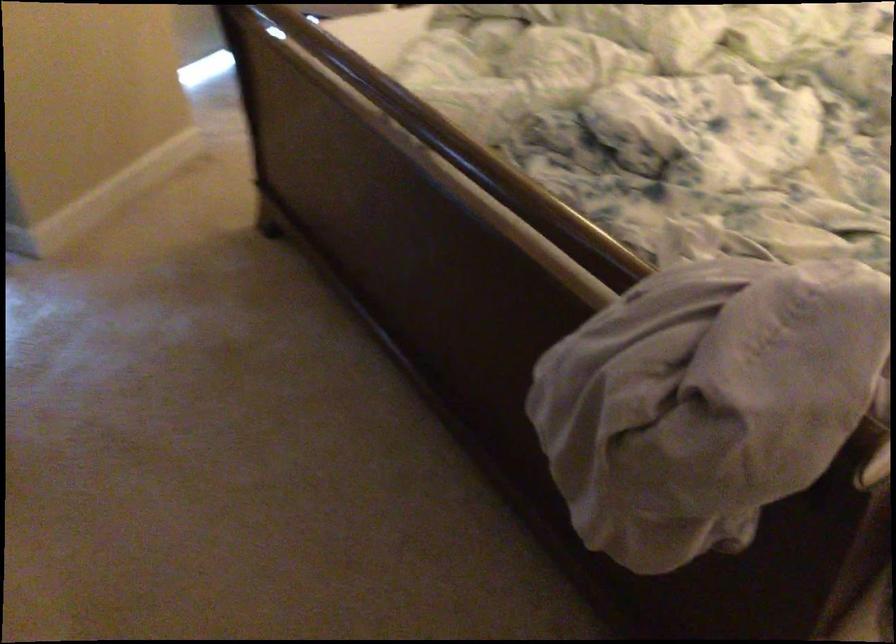
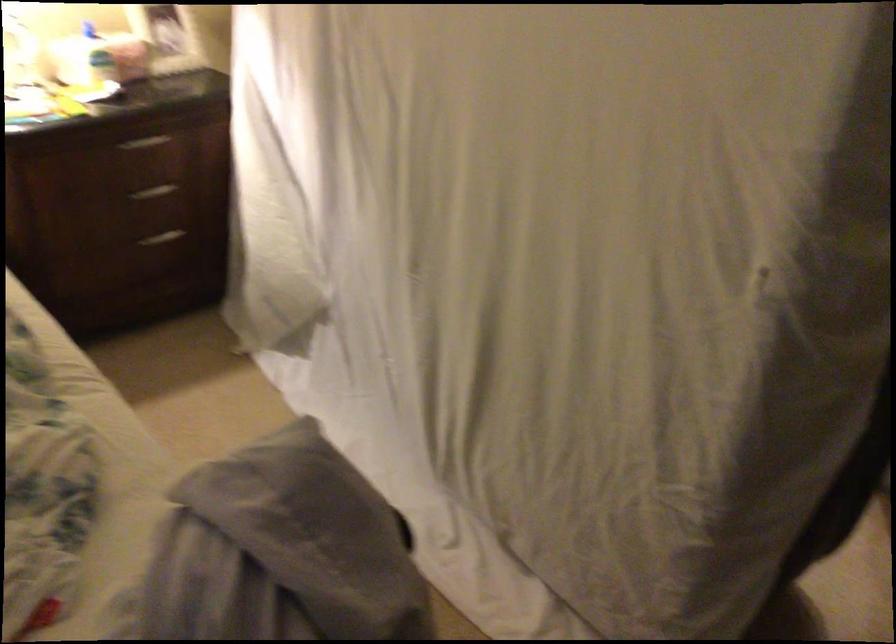
The first image is from the beginning of the video and the second image is from the end. How did the camera likely rotate when shooting the video?

The camera's rotation is toward right-down.